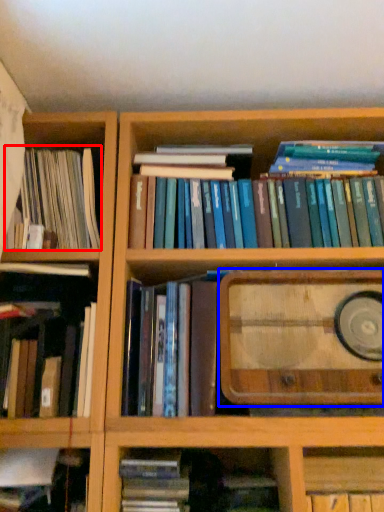
Question: Which object is closer to the camera taking this photo, book (highlighted by a red box) or book cover (highlighted by a blue box)?

Choices:
 (A) book
 (B) book cover

Answer: (B)